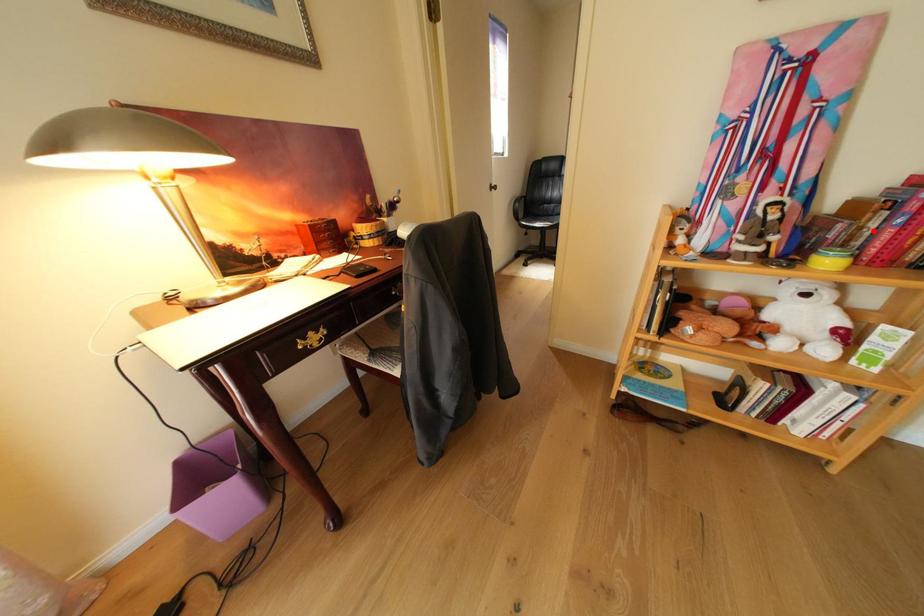
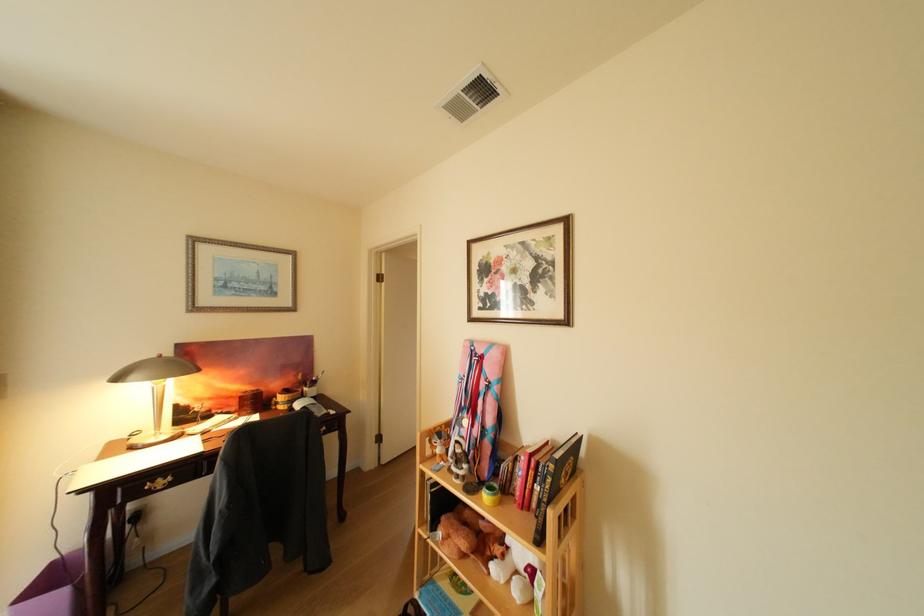
In the second image, find the point that corresponds to the highlighted location in the first image.

(525, 475)